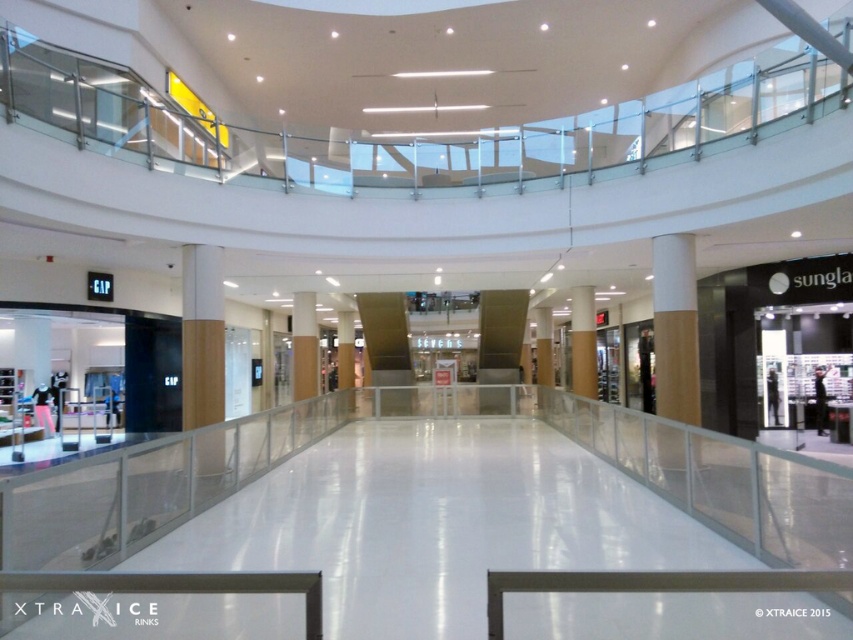
Question: Which object is positioned farthest from the white wood column at center?

Choices:
 (A) brown polished pillar at center
 (B) smooth beige pillar at center

Answer: (B)

Question: Estimate the real-world distances between objects in this image. Which object is closer to the brown polished pillar at center?

Choices:
 (A) wooden pillar at center
 (B) white wood column at center
 (C) smooth beige pillar at center
 (D) brown wood pillar at center

Answer: (C)

Question: Considering the real-world distances, which object is closest to the smooth beige pillar at center?

Choices:
 (A) white wood column at center
 (B) brown wood pillar at center
 (C) wooden pillar at center
 (D) brown polished pillar at center

Answer: (D)

Question: Is white wood column at center to the right of brown wood pillar at center from the viewer's perspective?

Choices:
 (A) no
 (B) yes

Answer: (B)

Question: Does brown polished pillar at center appear over smooth beige pillar at center?

Choices:
 (A) yes
 (B) no

Answer: (A)

Question: Is white wood column at center further to the viewer compared to brown polished pillar at center?

Choices:
 (A) no
 (B) yes

Answer: (A)